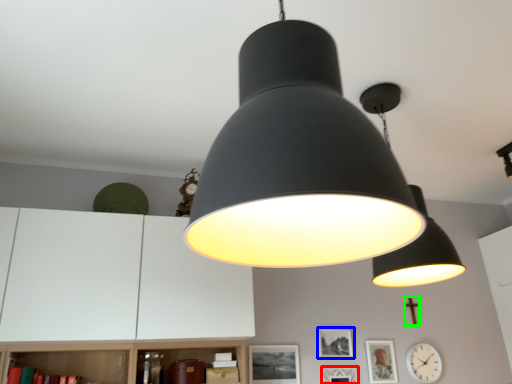
Question: Estimate the real-world distances between objects in this image. Which object is closer to picture frame (highlighted by a red box), picture frame (highlighted by a blue box) or crucifix (highlighted by a green box)?

Choices:
 (A) picture frame
 (B) crucifix

Answer: (A)